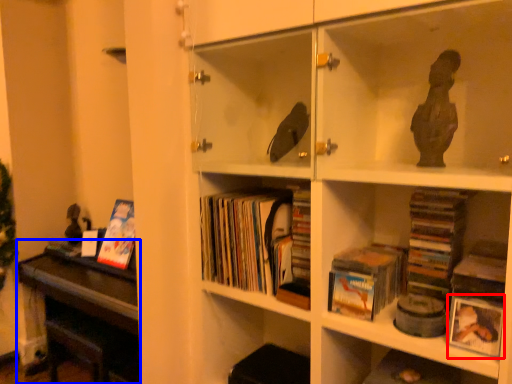
Question: Which of the following is the farthest to the observer, paperback book (highlighted by a red box) or table (highlighted by a blue box)?

Choices:
 (A) paperback book
 (B) table

Answer: (B)